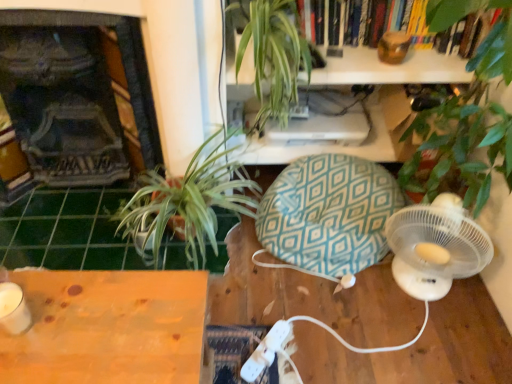
Where is `vacant space behind white plastic wii controller at lower center`? Image resolution: width=512 pixels, height=384 pixels. vacant space behind white plastic wii controller at lower center is located at coordinates (265, 304).